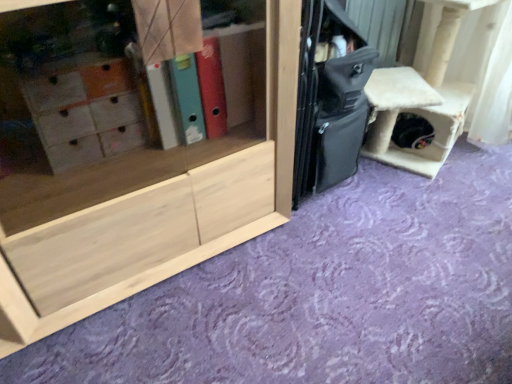
Question: From their relative heights in the image, would you say black matte suitcase at center is taller or shorter than natural wood cabinet at center?

Choices:
 (A) short
 (B) tall

Answer: (A)

Question: Is black matte suitcase at center bigger or smaller than natural wood cabinet at center?

Choices:
 (A) small
 (B) big

Answer: (A)

Question: Estimate the real-world distances between objects in this image. Which object is closer to the black matte suitcase at center?

Choices:
 (A) white fluffy cat house at right
 (B) natural wood cabinet at center

Answer: (B)

Question: Based on their relative distances, which object is farther from the natural wood cabinet at center?

Choices:
 (A) black matte suitcase at center
 (B) white fluffy cat house at right

Answer: (B)